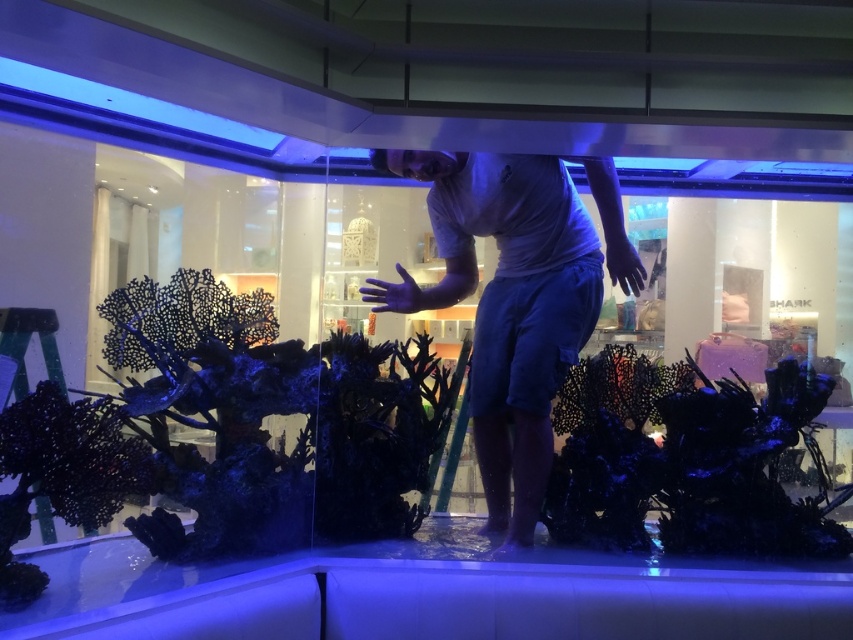
Please describe the location of the point marked at coordinates (506, 305) in the scene. What object is located there?

The point at coordinates (506, 305) marks the location of the white matte shirt at center.

In the scene shown: You are designing a new exhibit for an aquarium and need to ensure that the mannequin wearing the white matte shirt at center will fit alongside the black matte coral at center. Based on the image, which object is wider?

The black matte coral at center is wider than the white matte shirt at center.

You are a customer in the store and want to take a photo of the white matte shirt at center and the black matte coral at center. Which object will appear closer to the camera in your photo?

The white matte shirt at center is further to the viewer than the black matte coral at center, so it will appear closer to the camera in the photo.